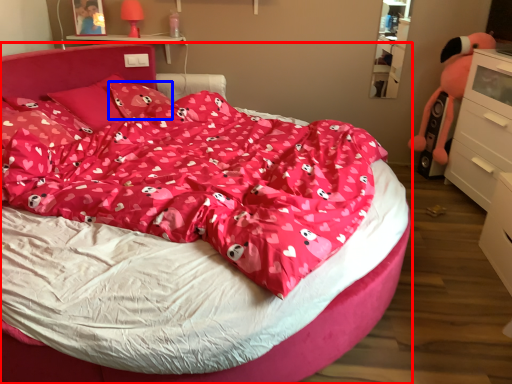
Question: Which of the following is the closest to the observer, bed (highlighted by a red box) or pillow (highlighted by a blue box)?

Choices:
 (A) bed
 (B) pillow

Answer: (A)